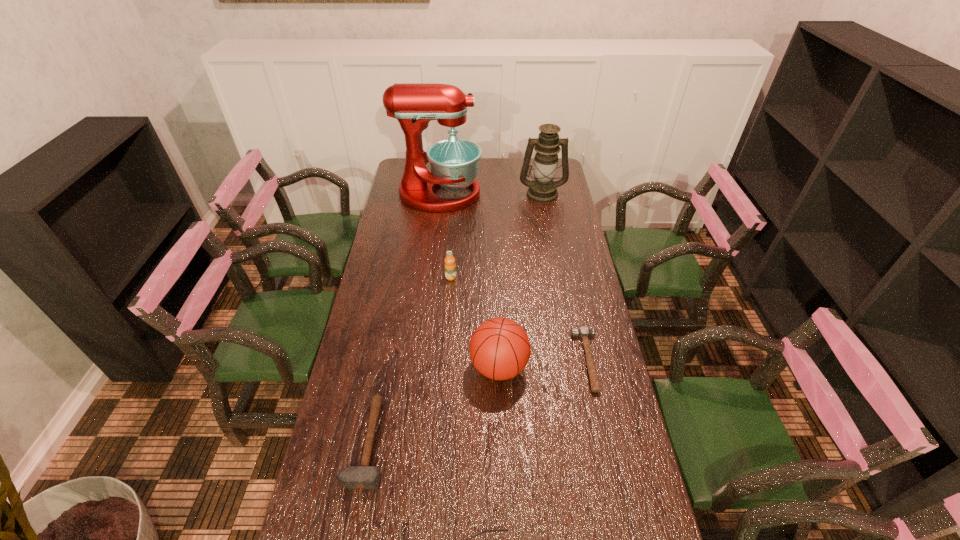
The image size is (960, 540). Find the location of `empty location between the second nearest object and the orange juice`. empty location between the second nearest object and the orange juice is located at coordinates (409, 360).

Locate an element on the screen. The image size is (960, 540). free spot between the second tallest object and the right hammer is located at coordinates (565, 277).

Locate an element on the screen. The image size is (960, 540). unoccupied position between the mixer and the sixth shortest object is located at coordinates (491, 194).

Identify the location of object that ranks as the sixth closest to the oil lamp. The width and height of the screenshot is (960, 540). (496, 529).

I want to click on object that stands as the fourth closest to the shorter hammer, so click(x=364, y=476).

Identify the location of vacant space that satisfies the following two spatial constraints: 1. on the label of the basketball; 2. on the left side of the fifth nearest object. (444, 367).

Identify the location of vacant position in the image that satisfies the following two spatial constraints: 1. on the label of the fourth tallest object; 2. on the striking surface of the nearer hammer. The height and width of the screenshot is (540, 960). (440, 443).

I want to click on vacant space that satisfies the following two spatial constraints: 1. on the label of the fourth tallest object; 2. on the striking surface of the sixth farthest object, so click(440, 443).

Identify the location of free region that satisfies the following two spatial constraints: 1. on the label of the orange juice; 2. on the striking surface of the nearer hammer. (440, 443).